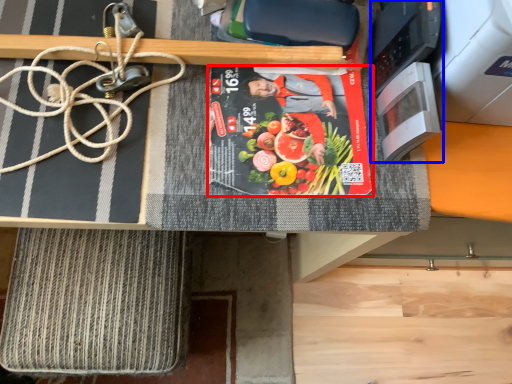
Question: Which of the following is the closest to the observer, paperback book (highlighted by a red box) or appliance (highlighted by a blue box)?

Choices:
 (A) paperback book
 (B) appliance

Answer: (B)